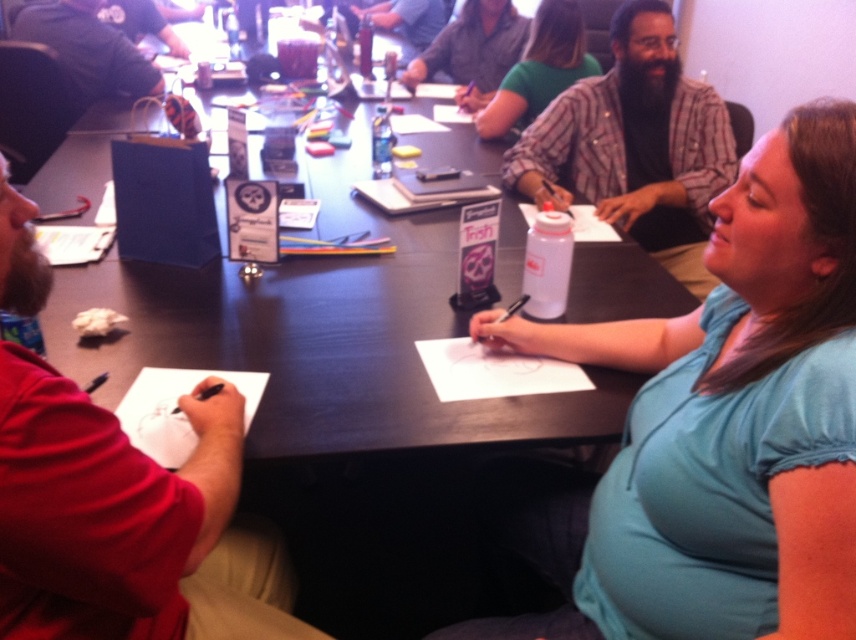
You are standing in front of the black glossy table at center and want to hand a document to the person wearing the green matte shirt at center. Can you directly hand it to them without moving from your current position?

The black glossy table at center is closer to the viewer than the green matte shirt at center, so you are closer to the table and farther from the person. You would need to move closer to the green matte shirt at center to hand them the document directly.